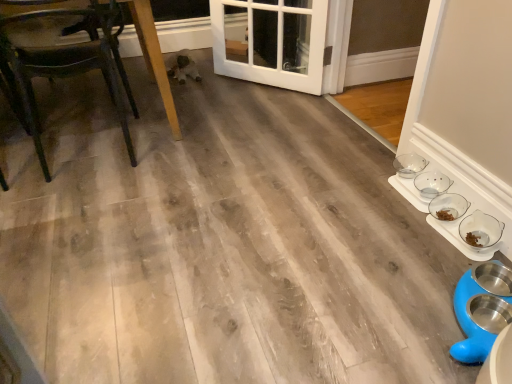
Question: From the image's perspective, is white glossy door at center over clear glass bowl at lower right, the 3th bowl in the back-to-front sequence?

Choices:
 (A) no
 (B) yes

Answer: (B)

Question: Could you tell me if white glossy door at center is facing clear glass bowl at lower right, which is the first bowl from front to back?

Choices:
 (A) no
 (B) yes

Answer: (A)

Question: From the image's perspective, is white glossy door at center under clear glass bowl at lower right, the 3th bowl in the back-to-front sequence?

Choices:
 (A) no
 (B) yes

Answer: (A)

Question: Can you confirm if white glossy door at center is positioned to the right of clear glass bowl at lower right, which is the first bowl from front to back?

Choices:
 (A) no
 (B) yes

Answer: (A)

Question: Is white glossy door at center next to clear glass bowl at lower right, which is the first bowl from front to back?

Choices:
 (A) yes
 (B) no

Answer: (B)

Question: From a real-world perspective, relative to white glossy door at center, is clear glass bowls at right, which is counted as the 1th bowl, starting from the back, vertically above or below?

Choices:
 (A) below
 (B) above

Answer: (A)

Question: From the image's perspective, is clear glass bowls at right, which is counted as the 1th bowl, starting from the back, above or below white glossy door at center?

Choices:
 (A) below
 (B) above

Answer: (A)

Question: Which is correct: clear glass bowls at right, which is counted as the 1th bowl, starting from the back, is inside white glossy door at center, or outside of it?

Choices:
 (A) inside
 (B) outside

Answer: (B)

Question: Is point (419, 158) positioned closer to the camera than point (232, 61)?

Choices:
 (A) farther
 (B) closer

Answer: (B)

Question: From a real-world perspective, relative to white glossy door at center, is clear glass bowl at lower right, which is the first bowl from front to back, vertically above or below?

Choices:
 (A) above
 (B) below

Answer: (B)

Question: Which is correct: clear glass bowl at lower right, which is the first bowl from front to back, is inside white glossy door at center, or outside of it?

Choices:
 (A) inside
 (B) outside

Answer: (B)

Question: Considering their positions, is clear glass bowl at lower right, the 3th bowl in the back-to-front sequence, located in front of or behind white glossy door at center?

Choices:
 (A) front
 (B) behind

Answer: (A)

Question: From the image's perspective, is clear glass bowl at lower right, the 3th bowl in the back-to-front sequence, positioned above or below white glossy door at center?

Choices:
 (A) below
 (B) above

Answer: (A)

Question: Relative to white glossy door at center, is wooden chair at left in front or behind?

Choices:
 (A) behind
 (B) front

Answer: (B)

Question: Which is correct: wooden chair at left is inside white glossy door at center, or outside of it?

Choices:
 (A) inside
 (B) outside

Answer: (B)